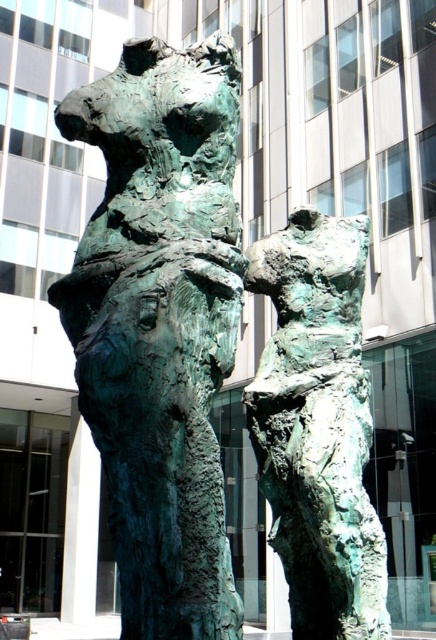
Question: In this image, where is green patina sculpture at center located relative to green patina bronze statue at center?

Choices:
 (A) above
 (B) below

Answer: (A)

Question: Is green patina sculpture at center to the right of green patina bronze statue at center from the viewer's perspective?

Choices:
 (A) yes
 (B) no

Answer: (B)

Question: Considering the relative positions of green patina sculpture at center and green patina bronze statue at center in the image provided, where is green patina sculpture at center located with respect to green patina bronze statue at center?

Choices:
 (A) above
 (B) below

Answer: (A)

Question: Among these points, which one is farthest from the camera?

Choices:
 (A) (218, 497)
 (B) (340, 436)

Answer: (B)